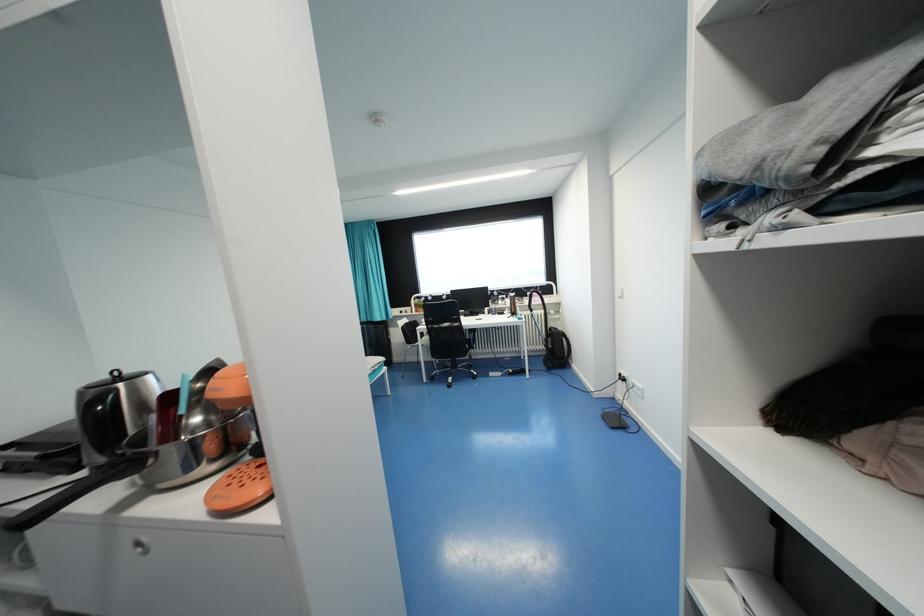
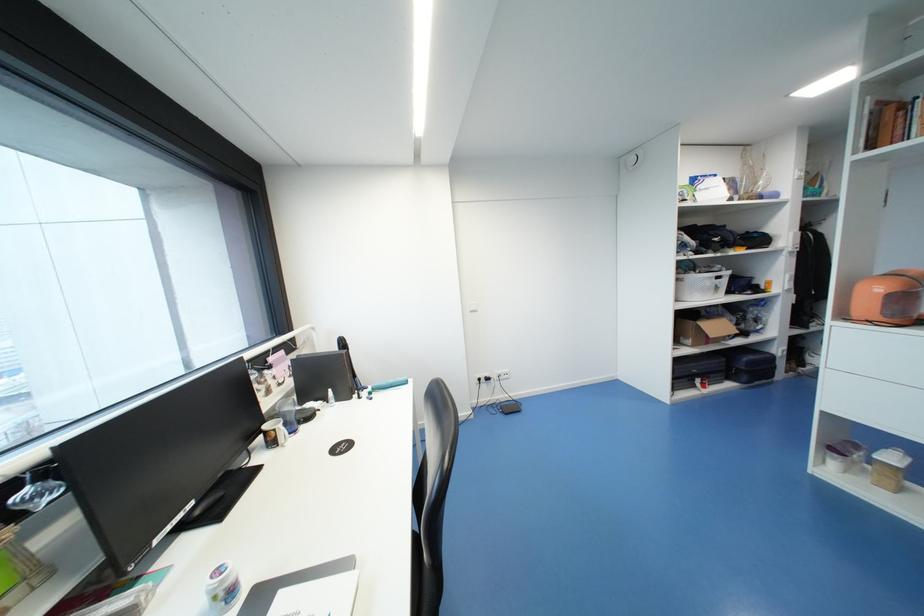
Question: I am providing you with two images of the same scene from different viewpoints. Which of the following objects are not visible in image2?

Choices:
 (A) white mug handle
 (B) tan container
 (C) black backpack
 (D) yellow headphones

Answer: (C)